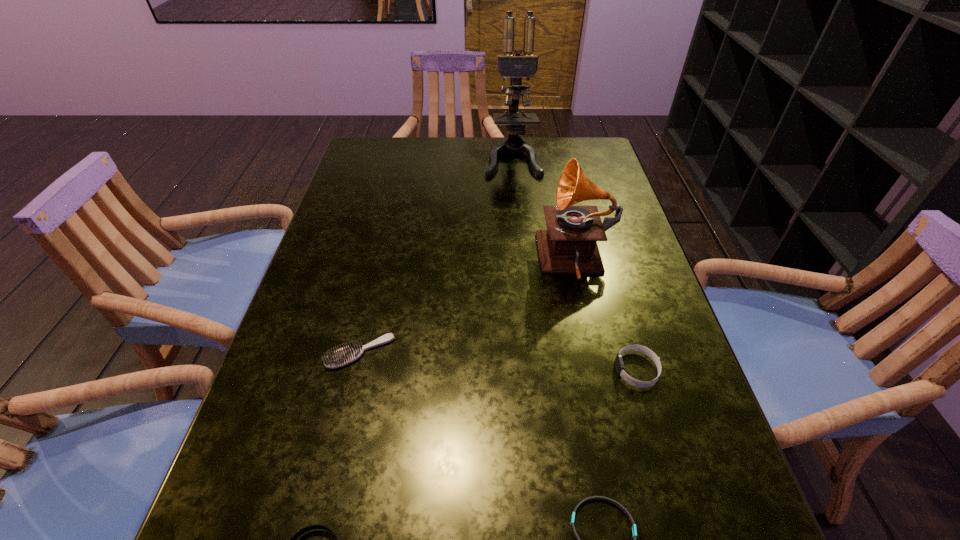
Find the location of `vacant region at the left edge of the desktop`. vacant region at the left edge of the desktop is located at coordinates (321, 256).

Locate an element on the screen. This screenshot has width=960, height=540. free space at the right edge of the desktop is located at coordinates (626, 212).

This screenshot has width=960, height=540. Find the location of `vacant region at the far left corner of the desktop`. vacant region at the far left corner of the desktop is located at coordinates (410, 139).

What are the coordinates of `vacant space at the far right corner of the desktop` in the screenshot? It's located at (604, 153).

Find the location of `unoccupied area between the scrubbing brush and the tallest wristband`. unoccupied area between the scrubbing brush and the tallest wristband is located at coordinates (498, 361).

Image resolution: width=960 pixels, height=540 pixels. In order to click on free space that is in between the fifth nearest object and the scrubbing brush in this screenshot , I will do `click(468, 307)`.

Identify which object is located as the nearest to the second tallest object. Please provide its 2D coordinates. Your answer should be formatted as a tuple, i.e. [(x, y)], where the tuple contains the x and y coordinates of a point satisfying the conditions above.

[(619, 364)]

You are a GUI agent. You are given a task and a screenshot of the screen. Output one action in this format:
    pyautogui.click(x=<x>, y=<y>)
    Task: Click on the object that can be found as the fifth closest to the shortest wristband
    
    Given the screenshot: What is the action you would take?
    pyautogui.click(x=516, y=66)

Find the location of a particular element. The height and width of the screenshot is (540, 960). wristband that stands as the closest to the rightmost wristband is located at coordinates (634, 530).

This screenshot has height=540, width=960. Find the location of `the closest wristband to the phonograph record`. the closest wristband to the phonograph record is located at coordinates (619, 364).